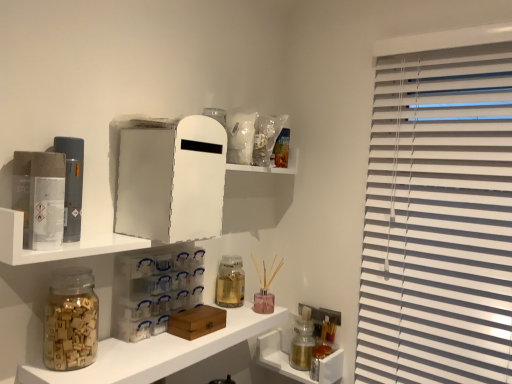
Question: Which direction should I rotate to face transparent plastic drawers at center, which is the first cabinet from left to right, — up or down?

Choices:
 (A) down
 (B) up

Answer: (A)

Question: From the image's perspective, is metallic silver canisters at lower right, arranged as the 1th cabinet when ordered from the bottom, below white matte medicine cabinet at upper center?

Choices:
 (A) yes
 (B) no

Answer: (A)

Question: Is white matte medicine cabinet at upper center inside metallic silver canisters at lower right, which is counted as the 1th cabinet, starting from the back?

Choices:
 (A) no
 (B) yes

Answer: (A)

Question: From a real-world perspective, is metallic silver canisters at lower right, which is counted as the 1th cabinet, starting from the back, physically above white matte medicine cabinet at upper center?

Choices:
 (A) yes
 (B) no

Answer: (B)

Question: From the image's perspective, is metallic silver canisters at lower right, the 2th cabinet positioned from the left, on top of white matte medicine cabinet at upper center?

Choices:
 (A) no
 (B) yes

Answer: (A)

Question: Are metallic silver canisters at lower right, which is counted as the second cabinet, starting from the top, and white matte medicine cabinet at upper center located far from each other?

Choices:
 (A) no
 (B) yes

Answer: (A)

Question: Is the depth of metallic silver canisters at lower right, which is the 2th cabinet from front to back, less than that of white matte medicine cabinet at upper center?

Choices:
 (A) no
 (B) yes

Answer: (A)

Question: Is translucent glass bottle at lower right, which is the first bottle in back-to-front order, shorter than translucent glass jar at lower left, the 2th shelf when ordered from top to bottom?

Choices:
 (A) yes
 (B) no

Answer: (B)

Question: Does translucent glass bottle at lower right, marked as the first bottle in a right-to-left arrangement, appear on the right side of translucent glass jar at lower left, the 2th shelf when ordered from top to bottom?

Choices:
 (A) yes
 (B) no

Answer: (A)

Question: From a real-world perspective, is translucent glass bottle at lower right, marked as the first bottle in a right-to-left arrangement, on top of translucent glass jar at lower left, the 2th shelf when ordered from top to bottom?

Choices:
 (A) yes
 (B) no

Answer: (B)

Question: Does translucent glass bottle at lower right, marked as the first bottle in a right-to-left arrangement, have a lesser width compared to translucent glass jar at lower left, which is the 1th shelf in bottom-to-top order?

Choices:
 (A) yes
 (B) no

Answer: (A)

Question: Is translucent glass bottle at lower right, which is the first bottle in back-to-front order, at the left side of translucent glass jar at lower left, which is the 1th shelf in bottom-to-top order?

Choices:
 (A) no
 (B) yes

Answer: (A)

Question: Is translucent glass bottle at lower right, which appears as the 1th bottle when ordered from the bottom, oriented away from translucent glass jar at lower left, which is the 1th shelf in bottom-to-top order?

Choices:
 (A) no
 (B) yes

Answer: (A)

Question: Can you confirm if translucent glass jar at lower left, the 2th shelf when ordered from top to bottom, is shorter than translucent glass jar at center, which appears as the 1th bottle when viewed from the front?

Choices:
 (A) yes
 (B) no

Answer: (A)